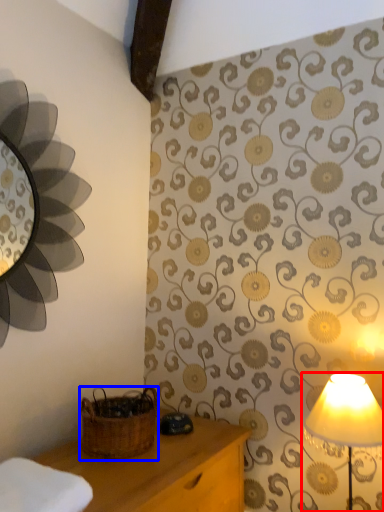
Question: Which point is further to the camera, lamp (highlighted by a red box) or basket (highlighted by a blue box)?

Choices:
 (A) lamp
 (B) basket

Answer: (B)